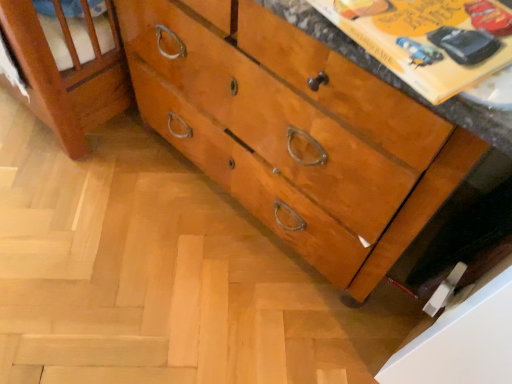
This screenshot has width=512, height=384. What do you see at coordinates (429, 39) in the screenshot? I see `yellow paper at upper right` at bounding box center [429, 39].

What is the approximate width of yellow paper at upper right?

yellow paper at upper right is 8.96 inches wide.

This screenshot has width=512, height=384. In order to click on yellow paper at upper right in this screenshot , I will do `click(429, 39)`.

You are a GUI agent. You are given a task and a screenshot of the screen. Output one action in this format:
    pyautogui.click(x=<x>, y=<y>)
    Task: Click on the shiny wood chest of drawers at center
    
    Given the screenshot: What is the action you would take?
    pyautogui.click(x=319, y=153)

The height and width of the screenshot is (384, 512). What do you see at coordinates (319, 153) in the screenshot?
I see `shiny wood chest of drawers at center` at bounding box center [319, 153].

Measure the distance between point (355, 76) and camera.

Point (355, 76) is 22.87 inches from camera.

Locate an element on the screen. yellow paper at upper right is located at coordinates (429, 39).

Can you confirm if shiny wood chest of drawers at center is positioned to the right of yellow paper at upper right?

No, shiny wood chest of drawers at center is not to the right of yellow paper at upper right.

Which is in front, shiny wood chest of drawers at center or yellow paper at upper right?

Positioned in front is yellow paper at upper right.

Consider the image. Which point is more distant from viewer, (231, 185) or (399, 25)?

Positioned behind is point (231, 185).

From the image's perspective, is shiny wood chest of drawers at center located above or below yellow paper at upper right?

Based on their image positions, shiny wood chest of drawers at center is located above yellow paper at upper right.

From a real-world perspective, is shiny wood chest of drawers at center physically above yellow paper at upper right?

Actually, shiny wood chest of drawers at center is physically below yellow paper at upper right in the real world.

Considering the sizes of objects shiny wood chest of drawers at center and yellow paper at upper right in the image provided, who is thinner, shiny wood chest of drawers at center or yellow paper at upper right?

yellow paper at upper right is thinner.

Can you confirm if shiny wood chest of drawers at center is taller than yellow paper at upper right?

Indeed, shiny wood chest of drawers at center has a greater height compared to yellow paper at upper right.

Considering the relative sizes of shiny wood chest of drawers at center and yellow paper at upper right in the image provided, is shiny wood chest of drawers at center smaller than yellow paper at upper right?

No.

Is shiny wood chest of drawers at center situated inside yellow paper at upper right or outside?

The correct answer is: outside.

Is there a large distance between shiny wood chest of drawers at center and yellow paper at upper right?

No.

Could you tell me if shiny wood chest of drawers at center is turned towards yellow paper at upper right?

No, shiny wood chest of drawers at center is not aimed at yellow paper at upper right.

How different are the orientations of shiny wood chest of drawers at center and yellow paper at upper right in degrees?

There is a 11.1-degree angle between the facing directions of shiny wood chest of drawers at center and yellow paper at upper right.

This screenshot has height=384, width=512. In order to click on paperback book that is in front of the shiny wood chest of drawers at center in this screenshot , I will do `click(429, 39)`.

Considering the positions of objects yellow paper at upper right and shiny wood chest of drawers at center in the image provided, who is more to the right, yellow paper at upper right or shiny wood chest of drawers at center?

Positioned to the right is yellow paper at upper right.

Considering the positions of objects yellow paper at upper right and shiny wood chest of drawers at center in the image provided, who is behind, yellow paper at upper right or shiny wood chest of drawers at center?

Positioned behind is shiny wood chest of drawers at center.

Does point (460, 68) come farther from viewer compared to point (353, 223)?

No, (460, 68) is closer to viewer.

From the image's perspective, who appears lower, yellow paper at upper right or shiny wood chest of drawers at center?

yellow paper at upper right is shown below in the image.

From a real-world perspective, is yellow paper at upper right on top of shiny wood chest of drawers at center?

Yes, from a real-world perspective, yellow paper at upper right is over shiny wood chest of drawers at center

In terms of width, does yellow paper at upper right look wider or thinner when compared to shiny wood chest of drawers at center?

Clearly, yellow paper at upper right has less width compared to shiny wood chest of drawers at center.

Which of these two, yellow paper at upper right or shiny wood chest of drawers at center, stands shorter?

With less height is yellow paper at upper right.

Considering the relative sizes of yellow paper at upper right and shiny wood chest of drawers at center in the image provided, is yellow paper at upper right bigger than shiny wood chest of drawers at center?

Incorrect, yellow paper at upper right is not larger than shiny wood chest of drawers at center.

Is yellow paper at upper right positioned beyond the bounds of shiny wood chest of drawers at center?

Absolutely, yellow paper at upper right is external to shiny wood chest of drawers at center.

Is the surface of yellow paper at upper right in direct contact with shiny wood chest of drawers at center?

No, yellow paper at upper right is not touching shiny wood chest of drawers at center.

Is yellow paper at upper right positioned with its back to shiny wood chest of drawers at center?

No, shiny wood chest of drawers at center is not at the back of yellow paper at upper right.

How much distance is there between yellow paper at upper right and shiny wood chest of drawers at center?

They are 15.09 inches apart.

The image size is (512, 384). I want to click on the chest of drawers located underneath the yellow paper at upper right (from a real-world perspective), so click(x=319, y=153).

Where is `paperback book that is in front of the shiny wood chest of drawers at center`? Image resolution: width=512 pixels, height=384 pixels. paperback book that is in front of the shiny wood chest of drawers at center is located at coordinates (429, 39).

I want to click on the chest of drawers that appears behind the yellow paper at upper right, so click(319, 153).